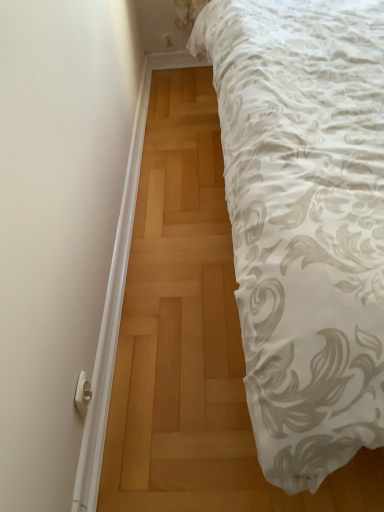
Question: Can you confirm if white floral fabric at upper right is shorter than white plastic door handle at lower left?

Choices:
 (A) no
 (B) yes

Answer: (A)

Question: Is white floral fabric at upper right taller than white plastic door handle at lower left?

Choices:
 (A) yes
 (B) no

Answer: (A)

Question: Is white floral fabric at upper right smaller than white plastic door handle at lower left?

Choices:
 (A) no
 (B) yes

Answer: (A)

Question: From the image's perspective, is white floral fabric at upper right located beneath white plastic door handle at lower left?

Choices:
 (A) no
 (B) yes

Answer: (A)

Question: Does white floral fabric at upper right appear on the left side of white plastic door handle at lower left?

Choices:
 (A) no
 (B) yes

Answer: (A)

Question: Can you confirm if white floral fabric at upper right is wider than white plastic door handle at lower left?

Choices:
 (A) yes
 (B) no

Answer: (A)

Question: Is white floral fabric at upper right inside white plastic door handle at lower left?

Choices:
 (A) no
 (B) yes

Answer: (A)

Question: From the image's perspective, is white plastic door handle at lower left located beneath white floral fabric at upper right?

Choices:
 (A) no
 (B) yes

Answer: (B)

Question: From a real-world perspective, is white plastic door handle at lower left on top of white floral fabric at upper right?

Choices:
 (A) no
 (B) yes

Answer: (A)

Question: Is white plastic door handle at lower left directly adjacent to white floral fabric at upper right?

Choices:
 (A) no
 (B) yes

Answer: (A)

Question: Is white plastic door handle at lower left outside of white floral fabric at upper right?

Choices:
 (A) no
 (B) yes

Answer: (B)

Question: Does white plastic door handle at lower left have a smaller size compared to white floral fabric at upper right?

Choices:
 (A) no
 (B) yes

Answer: (B)

Question: Would you say white plastic door handle at lower left is inside or outside white floral fabric at upper right?

Choices:
 (A) inside
 (B) outside

Answer: (B)